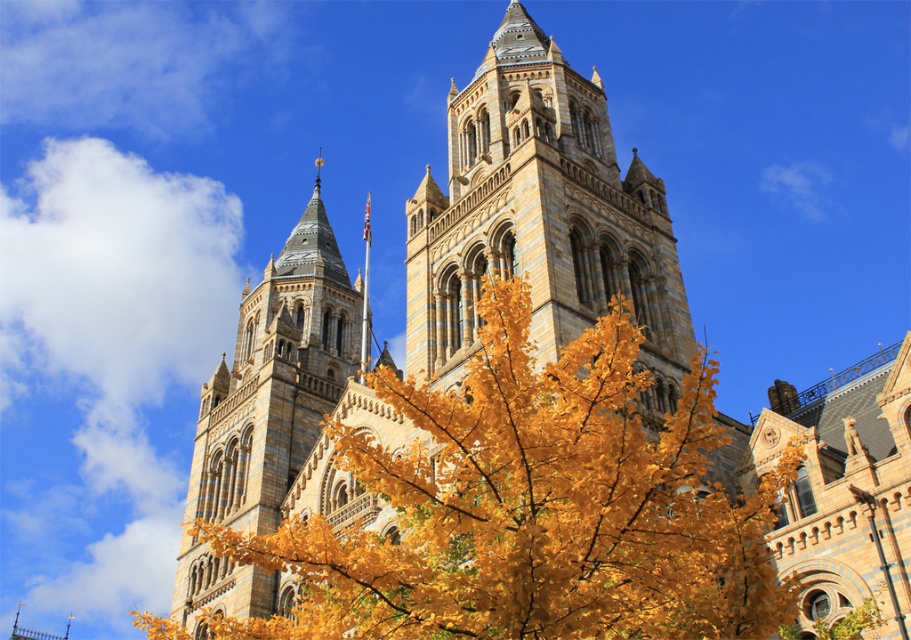
Question: Can you confirm if brown stone tower at center is positioned to the left of stone tower at center?

Choices:
 (A) no
 (B) yes

Answer: (A)

Question: Which of the following is the closest to the observer?

Choices:
 (A) (224, 433)
 (B) (534, 301)

Answer: (B)

Question: Can you confirm if brown stone tower at center is bigger than stone tower at center?

Choices:
 (A) yes
 (B) no

Answer: (B)

Question: Can you confirm if brown stone tower at center is bigger than stone tower at center?

Choices:
 (A) no
 (B) yes

Answer: (A)

Question: Which point is closer to the camera taking this photo?

Choices:
 (A) (241, 611)
 (B) (666, 237)

Answer: (A)